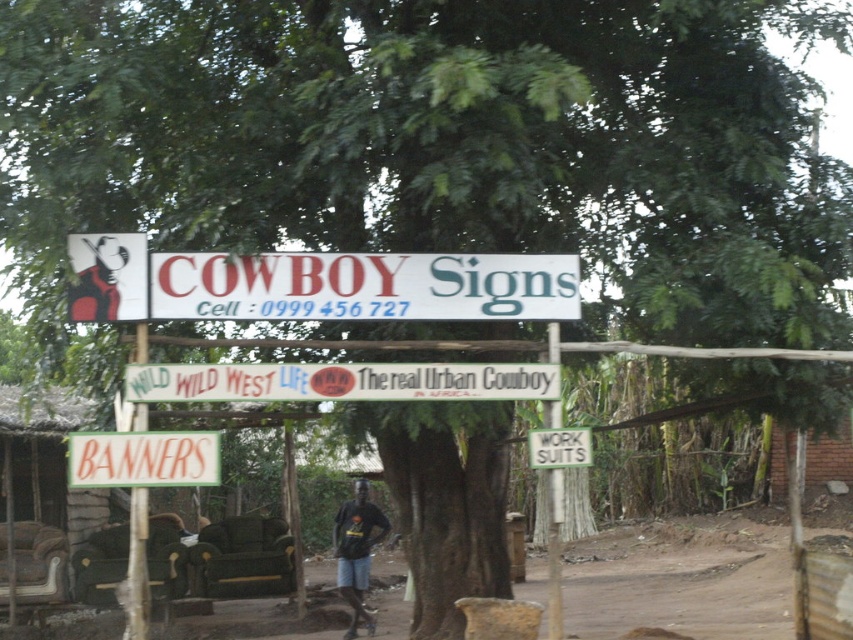
You are a photographer setting up a shot. You have a camera with a 50mm lens. The brown dirt field at lower center and the dark blue fabric shirt at center are both in your frame. Which object will appear larger in your photo?

The brown dirt field at lower center will appear larger in the photo because it is wider than the dark blue fabric shirt at center.

You are standing in the rustic outdoor setting described. You want to place a new sign that needs to be above the brown dirt field at lower center. Can you place it above the dark blue fabric shirt at center?

The brown dirt field at lower center is below the dark blue fabric shirt at center, so placing the new sign above the dark blue fabric shirt at center would also position it above the brown dirt field at lower center.